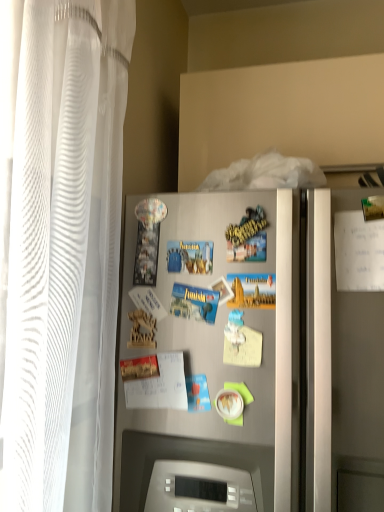
The width and height of the screenshot is (384, 512). In order to click on satin silver fridge at center in this screenshot , I will do `click(249, 361)`.

Describe the element at coordinates (249, 361) in the screenshot. The image size is (384, 512). I see `satin silver fridge at center` at that location.

Find the location of a particular element. Image resolution: width=384 pixels, height=512 pixels. satin silver fridge at center is located at coordinates (249, 361).